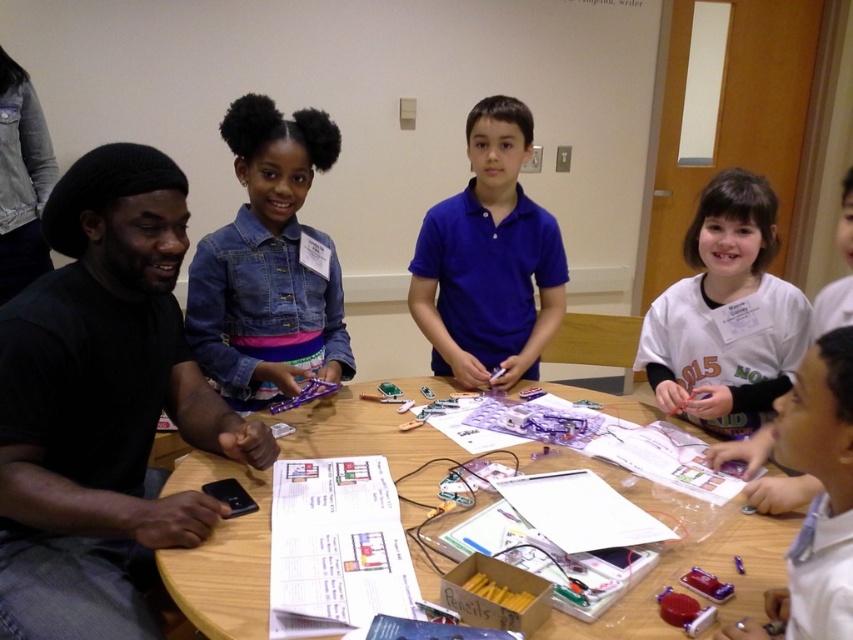
Can you confirm if blue matte shirt at center is thinner than white cotton shirt at upper right?

No, blue matte shirt at center is not thinner than white cotton shirt at upper right.

Does blue matte shirt at center appear under white cotton shirt at upper right?

No.

Does point (474, 122) lie behind point (751, 172)?

No, (474, 122) is in front of (751, 172).

This screenshot has width=853, height=640. I want to click on blue matte shirt at center, so click(488, 260).

Does point (338, 396) come farther from viewer compared to point (653, 344)?

Yes.

Identify the location of wooden table at center. Image resolution: width=853 pixels, height=640 pixels. (676, 552).

Locate an element on the screen. This screenshot has height=640, width=853. wooden table at center is located at coordinates (676, 552).

Based on the photo, between white cotton shirt at upper right and white glossy shirt at lower right, which one appears on the left side from the viewer's perspective?

From the viewer's perspective, white glossy shirt at lower right appears more on the left side.

Can you confirm if white cotton shirt at upper right is positioned above white glossy shirt at lower right?

Yes, white cotton shirt at upper right is above white glossy shirt at lower right.

Does point (721, 193) come farther from viewer compared to point (813, 550)?

Yes.

Where is `white cotton shirt at upper right`? This screenshot has height=640, width=853. white cotton shirt at upper right is located at coordinates (724, 314).